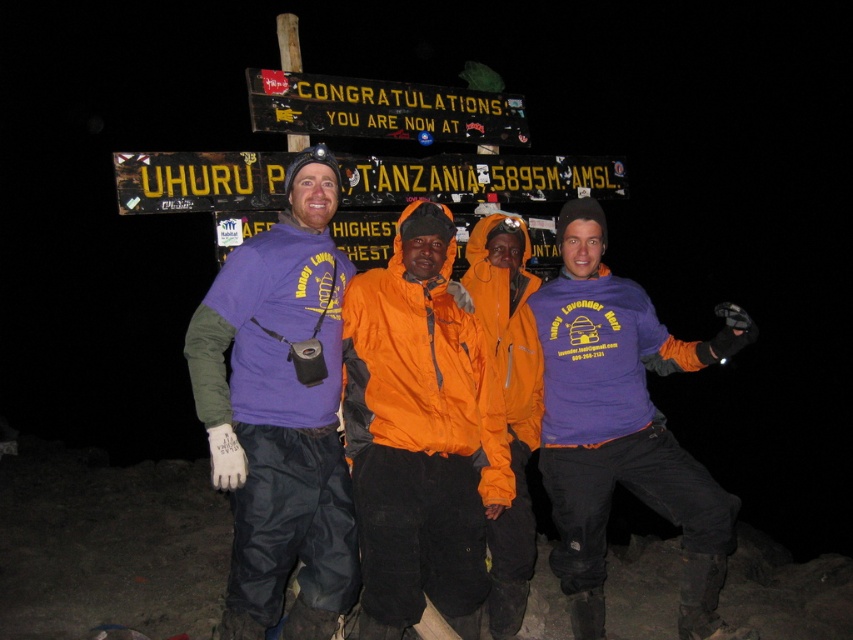
Question: Is purple fabric shirt at center to the right of yellow plastic sign at upper center from the viewer's perspective?

Choices:
 (A) yes
 (B) no

Answer: (B)

Question: Which object is positioned closest to the yellow plastic sign at upper center?

Choices:
 (A) purple fabric shirt at center
 (B) purple fleece jacket at center

Answer: (A)

Question: Does orange waterproof jacket at center have a larger size compared to yellow plastic sign at upper center?

Choices:
 (A) no
 (B) yes

Answer: (A)

Question: Based on their relative distances, which object is farther from the orange waterproof jacket at center?

Choices:
 (A) yellow plastic sign at upper center
 (B) purple fabric shirt at center

Answer: (A)

Question: Where is purple fleece jacket at center located in relation to yellow painted wood sign at upper center in the image?

Choices:
 (A) below
 (B) above

Answer: (A)

Question: Which point is closer to the camera taking this photo?

Choices:
 (A) (349, 156)
 (B) (711, 513)
 (C) (300, 124)
 (D) (310, 412)

Answer: (D)